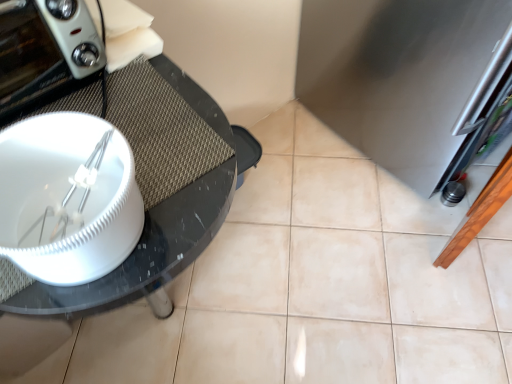
At what (x,y) coordinates should I click in order to perform the action: click on blank space situated above black glossy glass table at left (from a real-world perspective). Please return your answer as a coordinate pair (x, y). This screenshot has width=512, height=384. Looking at the image, I should click on (95, 167).